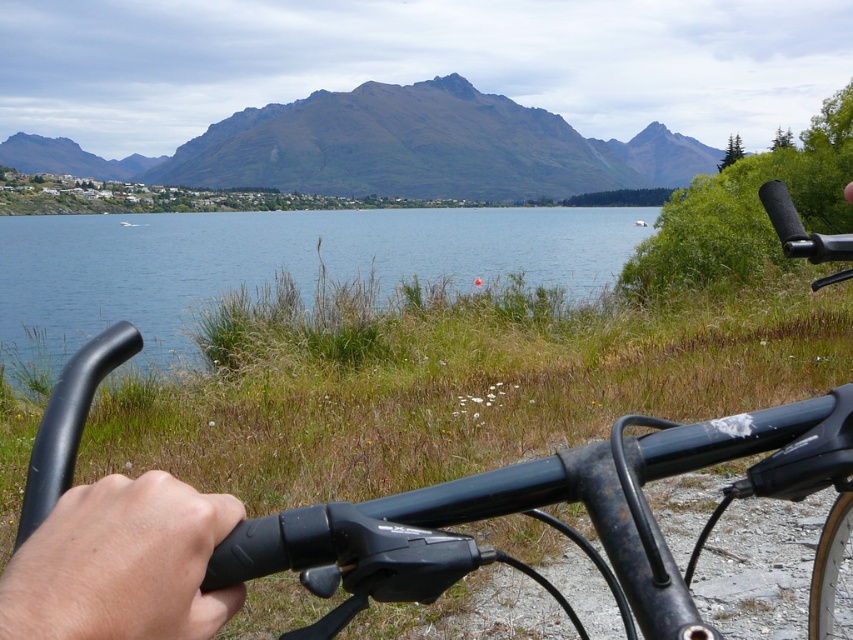
You are a drone operator who needs to fly a drone from the blue water at center to the brown rocky mountain at upper center. What is the minimum distance the drone must travel to reach the destination?

The minimum distance the drone must travel is 10.95 meters between the blue water at center and the brown rocky mountain at upper center.

You are taking a photo from the camera position. There are two points in the image, point 1 at coordinates point (x=482, y=244) and point 2 at coordinates point (x=402, y=134). Which point will appear larger in the photo?

Point 1 at coordinates point (x=482, y=244) is closer to the camera than point 2 at coordinates point (x=402, y=134), so it will appear larger in the photo.

As a cyclist, you want to check if your handlebars are narrow enough to fit through a narrow path ahead. Given that the blue water at center in the image is 1.2 meters wide, can your matte black bicycle handlebars at center fit through the path?

The matte black bicycle handlebars at center has a lesser width compared to blue water at center, which is 1.2 meters wide. Therefore, the handlebars are narrower than 1.2 meters and can fit through the path.